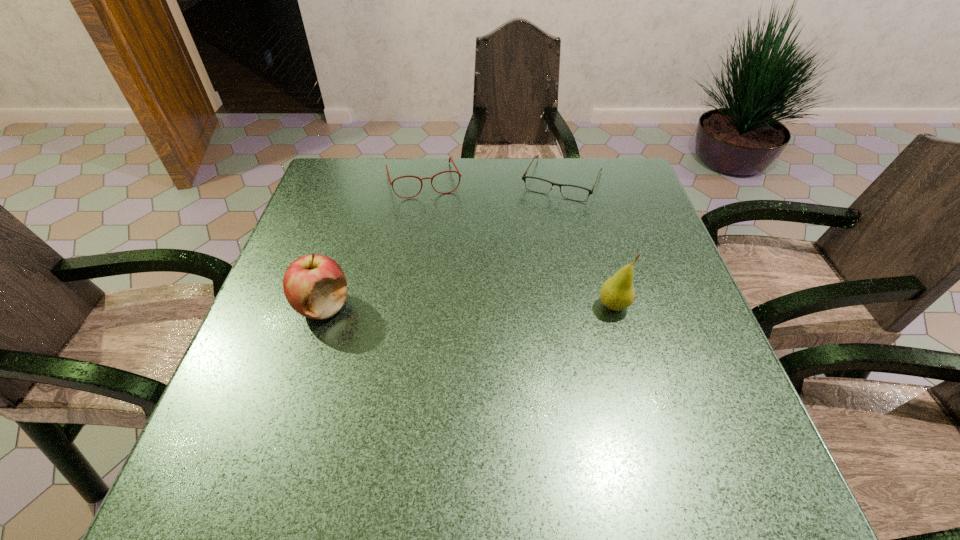
Locate an element on the screen. Image resolution: width=960 pixels, height=540 pixels. vacant region that satisfies the following two spatial constraints: 1. on the bitten side of the pear; 2. on the left side of the apple is located at coordinates (323, 306).

The image size is (960, 540). I want to click on vacant space that satisfies the following two spatial constraints: 1. on the front side of the pear; 2. on the left side of the left spectacles, so click(x=403, y=306).